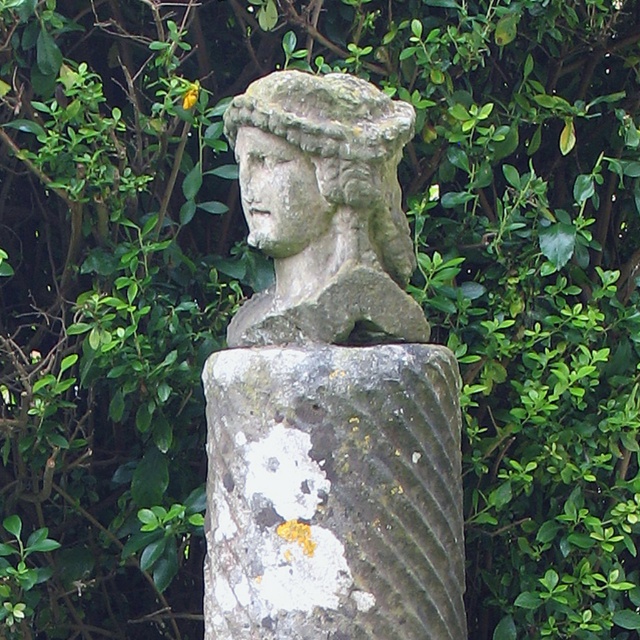
You are standing in front of the weathered stone statue. There are two points marked on the statue, one at coordinates point [298,416] and another at point [282,452]. If you were to walk around the statue, which point would you encounter first when approaching from the front?

Point [298,416] is in front of point [282,452], so you would encounter point [298,416] first when approaching from the front.

You are an art conservator assessing the stone statue at center and the stone statue head at center. Which part of the statue would require more material for restoration due to its size?

The stone statue at center is bigger than the stone statue head at center, so the stone statue at center would require more material for restoration due to its larger size.

You are an art conservator assessing the stone statue at center and the stone statue head at center. Which part of the statue is taller?

The stone statue at center is taller than the stone statue head at center.